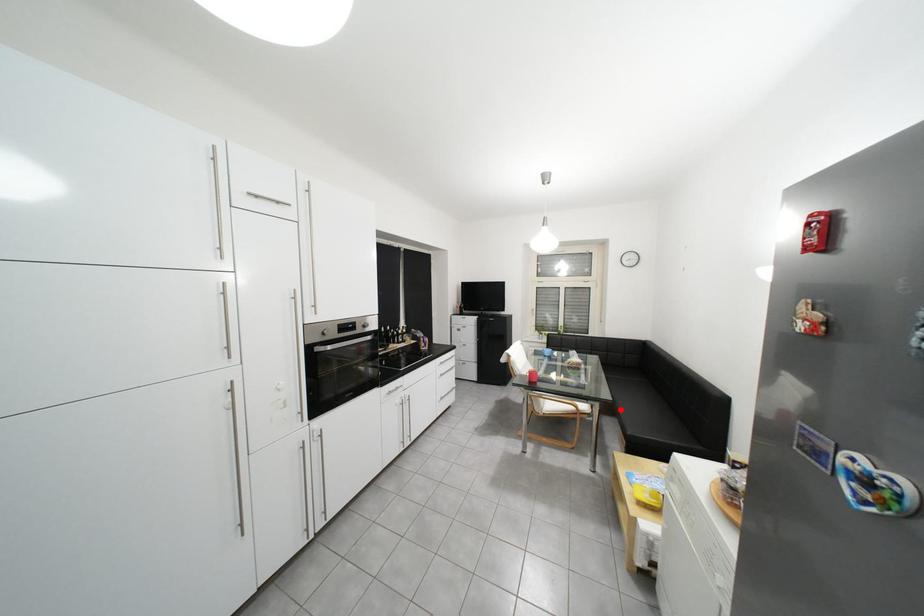
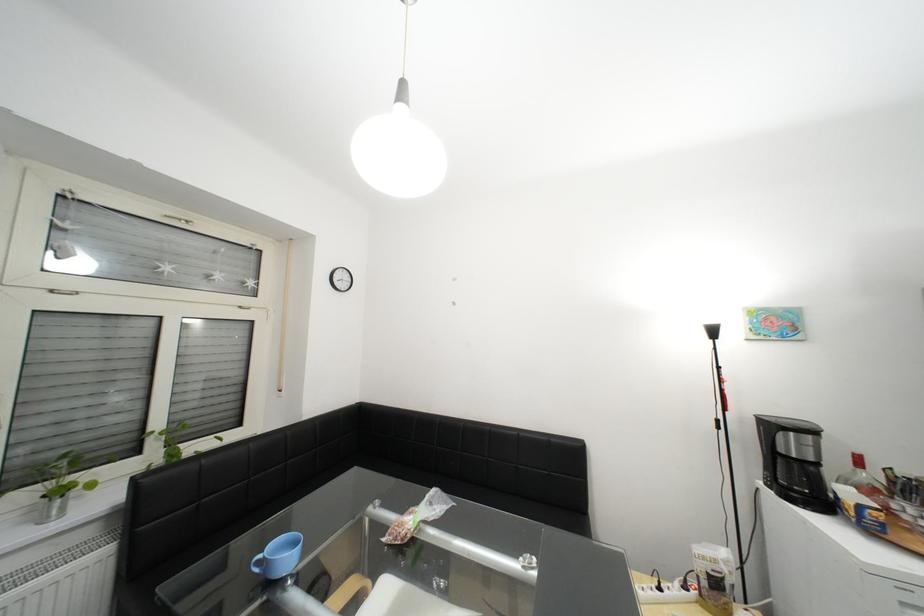
Question: I am providing you with two images of the same scene from different viewpoints. A red point is marked on the first image. Can you still see the location of the red point in image 2?

Choices:
 (A) Yes
 (B) No

Answer: (B)